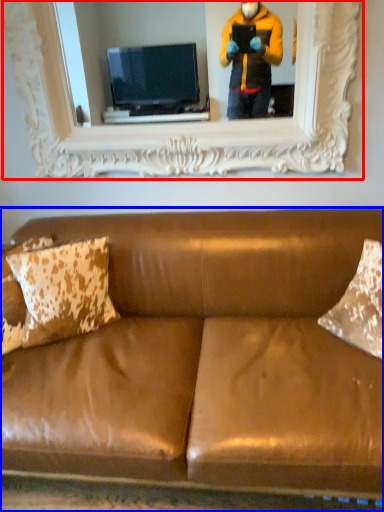
Question: Among these objects, which one is nearest to the camera, picture frame (highlighted by a red box) or studio couch (highlighted by a blue box)?

Choices:
 (A) picture frame
 (B) studio couch

Answer: (B)